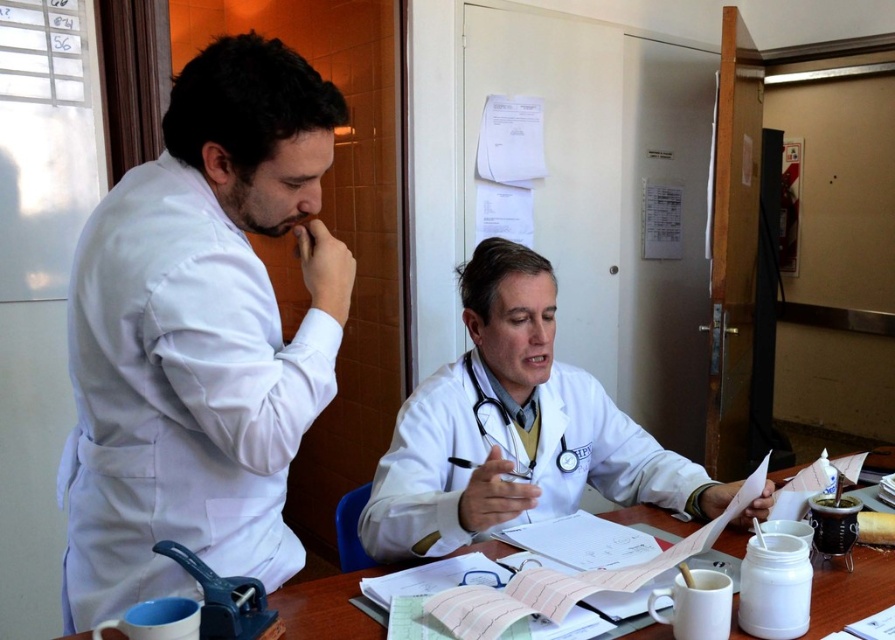
You are a medical student who needs to hand a report to the person wearing the white matte lab coat at left. You are currently standing 34.59 inches away from them. Can you reach them without moving closer?

The white matte lab coat at left and viewer are 34.59 inches apart. Since the distance is exactly 34.59 inches, you can reach them without moving closer if your reaching distance is at least 34.59 inches.

You are a medical student observing two professionals in a clinic. You see the white matte lab coat at left and the white rubber stethoscope at center. Which object is closer to the right side of the scene?

The white rubber stethoscope at center is closer to the right side of the scene because the white matte lab coat at left is positioned on the left side of it.

Based on the scene description, what is the 2D coordinate position of the white matte coat at center?

The white matte coat at center is located at the 2D coordinate point of (514,429).